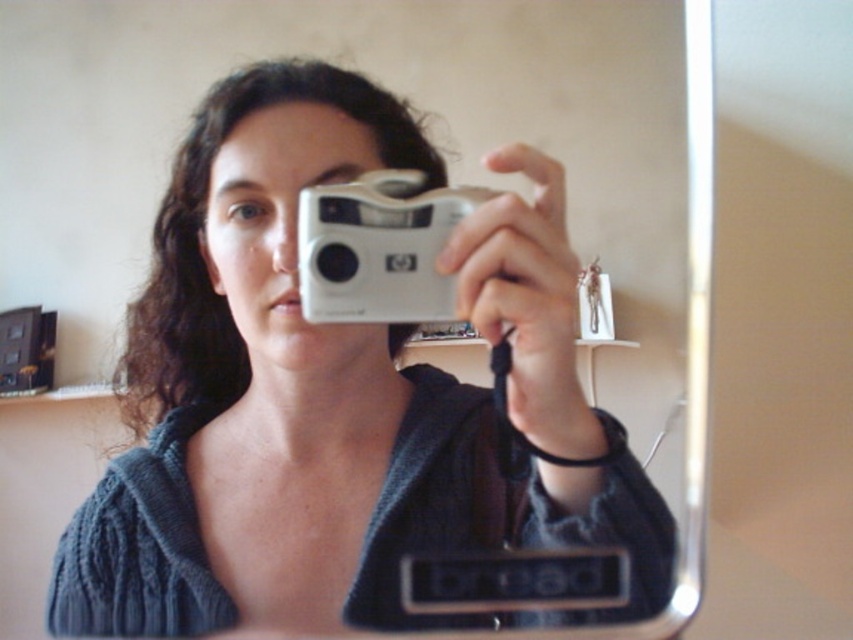
Is matte silver camera at center above knitted dark blue sweater at center?

Indeed, matte silver camera at center is positioned over knitted dark blue sweater at center.

Looking at this image, between matte silver camera at center and knitted dark blue sweater at center, which one has more height?

matte silver camera at center

Is point (463, 481) less distant than point (173, 445)?

That is True.

The height and width of the screenshot is (640, 853). In order to click on matte silver camera at center in this screenshot , I will do `click(334, 396)`.

Is knitted dark blue sweater at center bigger than silver metallic camera at center?

Yes.

Find the location of `knitted dark blue sweater at center`. knitted dark blue sweater at center is located at coordinates (496, 509).

Who is higher up, matte silver camera at center or silver metallic camera at center?

silver metallic camera at center

Locate an element on the screen. Image resolution: width=853 pixels, height=640 pixels. matte silver camera at center is located at coordinates click(334, 396).

Locate an element on the screen. The width and height of the screenshot is (853, 640). matte silver camera at center is located at coordinates (334, 396).